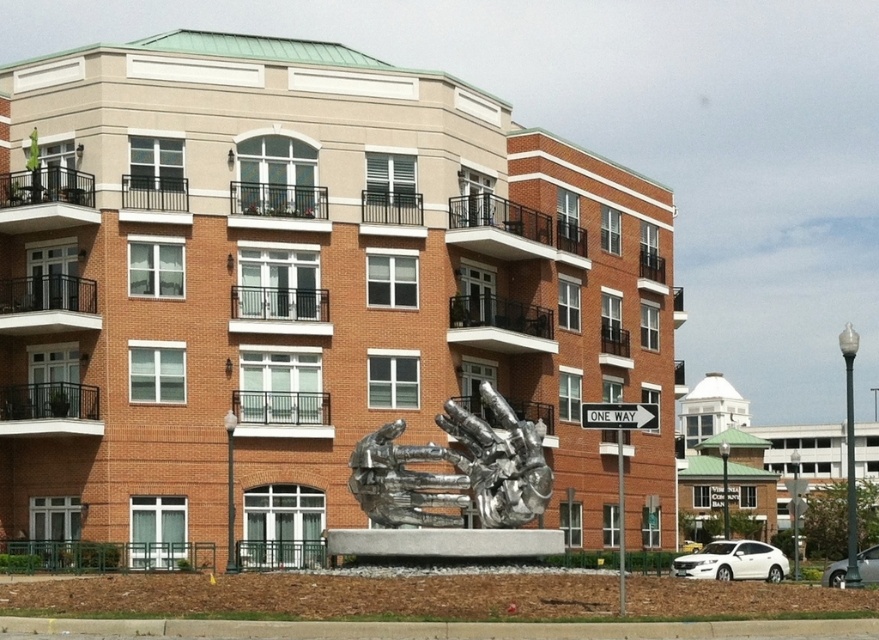
Is silver metallic hands at center positioned before white plastic street sign at center right?

No, it is not.

Is silver metallic hands at center to the right of white plastic street sign at center right from the viewer's perspective?

In fact, silver metallic hands at center is to the left of white plastic street sign at center right.

Does point (521, 442) lie in front of point (652, 417)?

No, (521, 442) is behind (652, 417).

Locate an element on the screen. silver metallic hands at center is located at coordinates (455, 474).